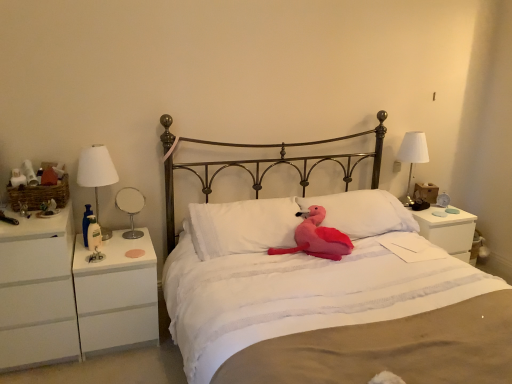
Find the location of `blank space situated above white plastic nightstand at left, the 2th nightstand in the left-to-right sequence (from a real-world perspective)`. blank space situated above white plastic nightstand at left, the 2th nightstand in the left-to-right sequence (from a real-world perspective) is located at coordinates (120, 246).